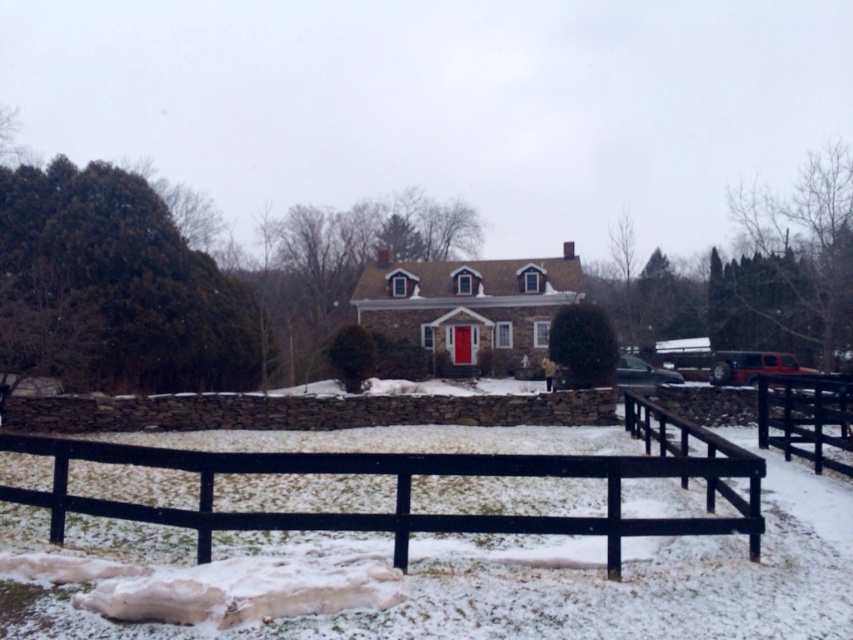
Question: Is black wooden fence at center below black wooden fence at lower right?

Choices:
 (A) yes
 (B) no

Answer: (A)

Question: Is black wooden fence at center positioned at the back of black wooden fence at lower right?

Choices:
 (A) no
 (B) yes

Answer: (A)

Question: Does black wooden fence at center appear on the left side of black wooden fence at lower right?

Choices:
 (A) no
 (B) yes

Answer: (B)

Question: Among these points, which one is farthest from the camera?

Choices:
 (A) (62, 508)
 (B) (763, 413)

Answer: (B)